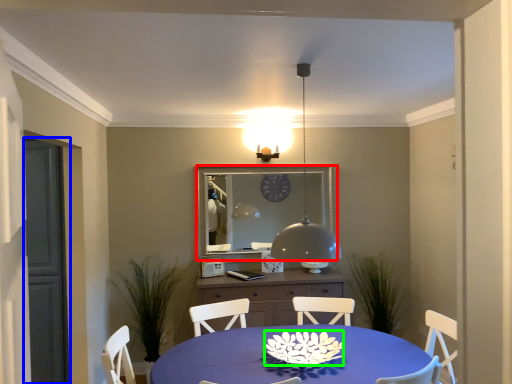
Question: Considering the real-world distances, which object is farthest from mirror (highlighted by a red box)? glass door (highlighted by a blue box) or flower (highlighted by a green box)?

Choices:
 (A) glass door
 (B) flower

Answer: (B)